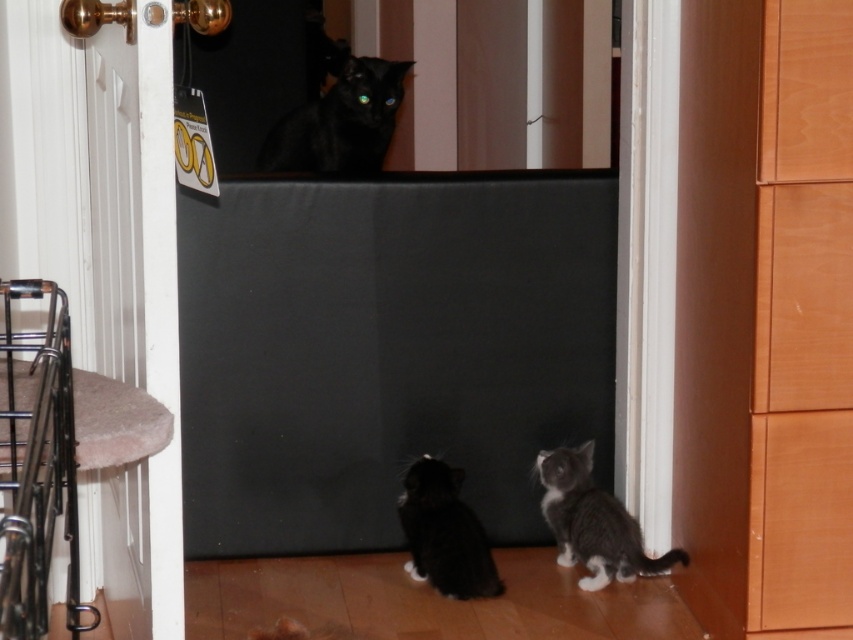
Question: Does shiny black cat at upper center lie in front of black fur cat at lower center?

Choices:
 (A) no
 (B) yes

Answer: (A)

Question: Considering the real-world distances, which object is closest to the soft fur cat at lower center?

Choices:
 (A) gray fluffy kitten at lower right
 (B) shiny black cat at upper center

Answer: (A)

Question: Which object appears closest to the camera in this image?

Choices:
 (A) gray fluffy kitten at lower right
 (B) shiny black cat at upper center
 (C) soft fur cat at lower center
 (D) black fur cat at lower center

Answer: (C)

Question: Considering the real-world distances, which object is farthest from the gray fluffy kitten at lower right?

Choices:
 (A) soft fur cat at lower center
 (B) black fur cat at lower center

Answer: (A)

Question: Does shiny black cat at upper center appear on the right side of soft fur cat at lower center?

Choices:
 (A) yes
 (B) no

Answer: (B)

Question: Is gray fluffy kitten at lower right further to the viewer compared to soft fur cat at lower center?

Choices:
 (A) no
 (B) yes

Answer: (B)